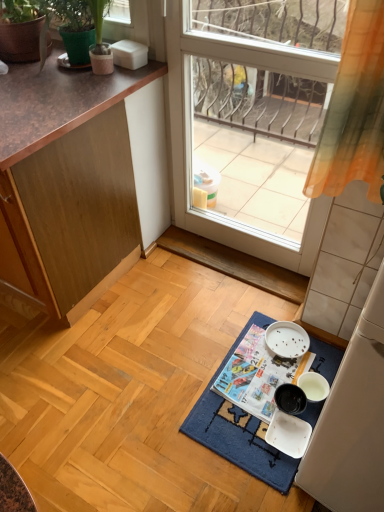
Image resolution: width=384 pixels, height=512 pixels. I want to click on free location above printed paper magazine at center (from a real-world perspective), so click(280, 356).